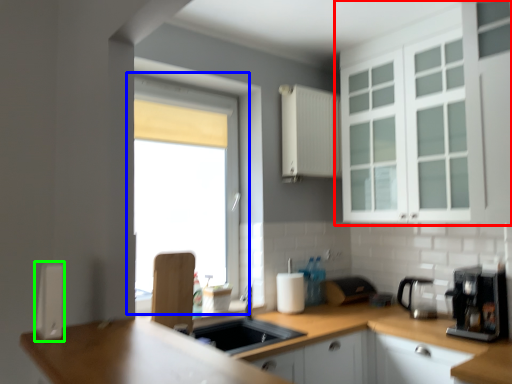
Question: Estimate the real-world distances between objects in this image. Which object is farther from cabinetry (highlighted by a red box), window (highlighted by a blue box) or appliance (highlighted by a green box)?

Choices:
 (A) window
 (B) appliance

Answer: (A)